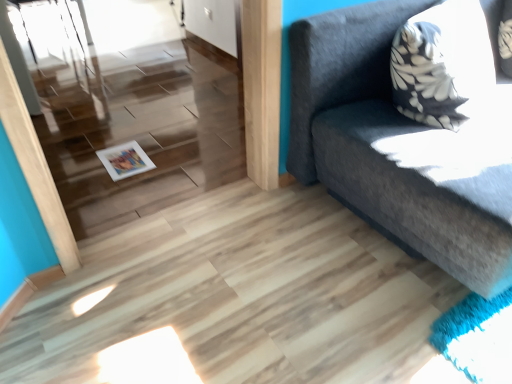
The width and height of the screenshot is (512, 384). Describe the element at coordinates (212, 22) in the screenshot. I see `white glossy door at upper center` at that location.

Identify the location of white glossy magazine at lower left. The height and width of the screenshot is (384, 512). (125, 160).

You are a GUI agent. You are given a task and a screenshot of the screen. Output one action in this format:
    pyautogui.click(x=<x>, y=<y>)
    Task: Click on the dark gray fabric couch at upper right
    The image size is (512, 384).
    Given the screenshot: What is the action you would take?
    pyautogui.click(x=397, y=147)

Is white glossy door at upper center taller or shorter than dark gray fabric couch at upper right?

white glossy door at upper center is shorter than dark gray fabric couch at upper right.

Does white glossy door at upper center contain dark gray fabric couch at upper right?

No, dark gray fabric couch at upper right is not a part of white glossy door at upper center.

In terms of width, does white glossy door at upper center look wider or thinner when compared to dark gray fabric couch at upper right?

white glossy door at upper center is thinner than dark gray fabric couch at upper right.

From a real-world perspective, between white glossy magazine at lower left and dark gray fabric couch at upper right, who is vertically higher?

dark gray fabric couch at upper right is physically above.

Consider the image. Is white glossy magazine at lower left with dark gray fabric couch at upper right?

They are not placed beside each other.

Between white glossy magazine at lower left and dark gray fabric couch at upper right, which one is positioned behind?

white glossy magazine at lower left is further from the camera.

How far apart are white glossy magazine at lower left and dark gray fabric couch at upper right?

white glossy magazine at lower left and dark gray fabric couch at upper right are 3.56 feet apart from each other.

From their relative heights in the image, would you say dark gray fabric couch at upper right is taller or shorter than white glossy magazine at lower left?

dark gray fabric couch at upper right is taller than white glossy magazine at lower left.

Between point (326, 174) and point (105, 167), which one is positioned behind?

The point (105, 167) is more distant.

You are a GUI agent. You are given a task and a screenshot of the screen. Output one action in this format:
    pyautogui.click(x=<x>, y=<y>)
    Task: Click on the magazine located behind the dark gray fabric couch at upper right
    Image resolution: width=512 pixels, height=384 pixels.
    Given the screenshot: What is the action you would take?
    pyautogui.click(x=125, y=160)

Considering the sizes of objects dark gray fabric couch at upper right and white glossy magazine at lower left in the image provided, who is bigger, dark gray fabric couch at upper right or white glossy magazine at lower left?

With larger size is dark gray fabric couch at upper right.

Is white glossy door at upper center positioned beyond the bounds of white glossy magazine at lower left?

Indeed, white glossy door at upper center is completely outside white glossy magazine at lower left.

From the image's perspective, is white glossy door at upper center over white glossy magazine at lower left?

Yes, from the image's perspective, white glossy door at upper center is above white glossy magazine at lower left.

Is white glossy door at upper center bigger or smaller than white glossy magazine at lower left?

white glossy door at upper center is bigger than white glossy magazine at lower left.

From a real-world perspective, is white glossy door at upper center positioned under white glossy magazine at lower left based on gravity?

No, from a real-world perspective, white glossy door at upper center is not beneath white glossy magazine at lower left.

Which object is positioned more to the left, dark gray fabric couch at upper right or white glossy door at upper center?

white glossy door at upper center is more to the left.

Is dark gray fabric couch at upper right positioned with its back to white glossy door at upper center?

That's right, dark gray fabric couch at upper right is facing away from white glossy door at upper center.

From a real-world perspective, is dark gray fabric couch at upper right positioned above or below white glossy door at upper center?

In terms of real-world spatial position, dark gray fabric couch at upper right is above white glossy door at upper center.

Is white glossy magazine at lower left shorter than white glossy door at upper center?

Yes, white glossy magazine at lower left is shorter than white glossy door at upper center.

Is white glossy door at upper center inside white glossy magazine at lower left?

No, white glossy magazine at lower left does not contain white glossy door at upper center.

Does white glossy magazine at lower left come in front of white glossy door at upper center?

Yes, the depth of white glossy magazine at lower left is less than that of white glossy door at upper center.

Visually, is white glossy magazine at lower left positioned to the left or to the right of white glossy door at upper center?

From the image, it's evident that white glossy magazine at lower left is to the left of white glossy door at upper center.

This screenshot has width=512, height=384. I want to click on door above the dark gray fabric couch at upper right (from the image's perspective), so click(212, 22).

Find the location of a particular element. The width and height of the screenshot is (512, 384). magazine below the dark gray fabric couch at upper right (from a real-world perspective) is located at coordinates (125, 160).

Looking at the image, which one is located closer to white glossy door at upper center, dark gray fabric couch at upper right or white glossy magazine at lower left?

Among the two, white glossy magazine at lower left is located nearer to white glossy door at upper center.

Consider the image. Based on their spatial positions, is white glossy magazine at lower left or white glossy door at upper center further from dark gray fabric couch at upper right?

white glossy door at upper center lies further to dark gray fabric couch at upper right than the other object.

Looking at the image, which one is located closer to white glossy magazine at lower left, dark gray fabric couch at upper right or white glossy door at upper center?

dark gray fabric couch at upper right lies closer to white glossy magazine at lower left than the other object.

Which object lies nearer to the anchor point dark gray fabric couch at upper right, white glossy door at upper center or white glossy magazine at lower left?

white glossy magazine at lower left lies closer to dark gray fabric couch at upper right than the other object.

Considering their positions, is white glossy door at upper center positioned further to white glossy magazine at lower left than dark gray fabric couch at upper right?

The object further to white glossy magazine at lower left is white glossy door at upper center.

Estimate the real-world distances between objects in this image. Which object is closer to white glossy door at upper center, white glossy magazine at lower left or dark gray fabric couch at upper right?

white glossy magazine at lower left is closer to white glossy door at upper center.

What are the coordinates of `magazine located between dark gray fabric couch at upper right and white glossy door at upper center in the depth direction` in the screenshot? It's located at [x=125, y=160].